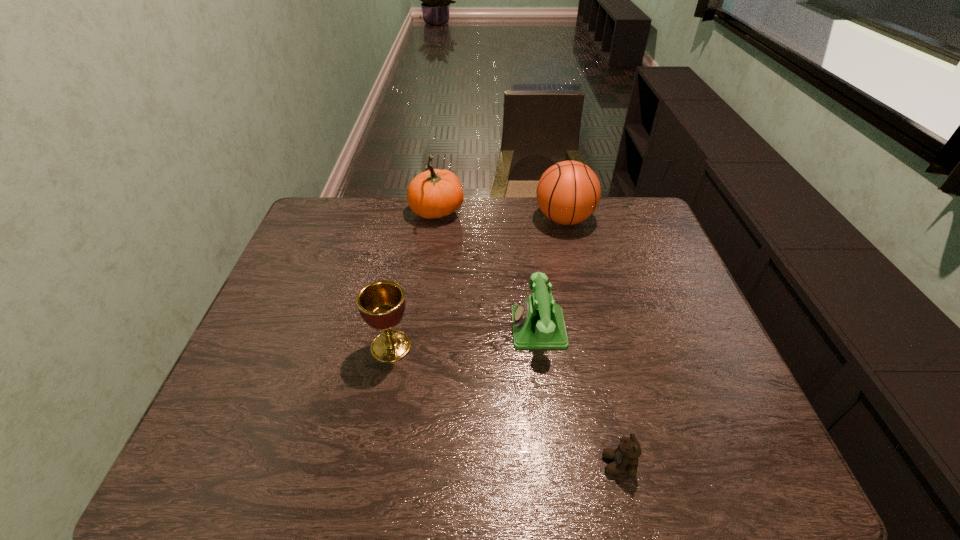
In the image, there is a desktop. At what (x,y) coordinates should I click in order to perform the action: click on free space at the left edge. Please return your answer as a coordinate pair (x, y). This screenshot has height=540, width=960. Looking at the image, I should click on (287, 355).

In the image, there is a desktop. Where is `vacant space at the right edge`? This screenshot has height=540, width=960. vacant space at the right edge is located at coordinates (694, 397).

Image resolution: width=960 pixels, height=540 pixels. Find the location of `free space at the far left corner of the desktop`. free space at the far left corner of the desktop is located at coordinates (331, 235).

This screenshot has width=960, height=540. In order to click on vacant space at the far right corner in this screenshot , I will do `click(650, 224)`.

The width and height of the screenshot is (960, 540). Identify the location of free space between the basketball and the pumpkin. (500, 216).

Image resolution: width=960 pixels, height=540 pixels. In order to click on vacant region between the basketball and the chalice in this screenshot , I will do `click(477, 283)`.

In order to click on vacant space in between the fourth tallest object and the basketball in this screenshot , I will do `click(551, 274)`.

At what (x,y) coordinates should I click in order to perform the action: click on empty location between the third shortest object and the teddy bear. Please return your answer as a coordinate pair (x, y). Looking at the image, I should click on (505, 405).

Identify the location of vacant area that lies between the teddy bear and the third tallest object. The height and width of the screenshot is (540, 960). (505, 405).

I want to click on free point between the nearest object and the telephone, so click(x=578, y=396).